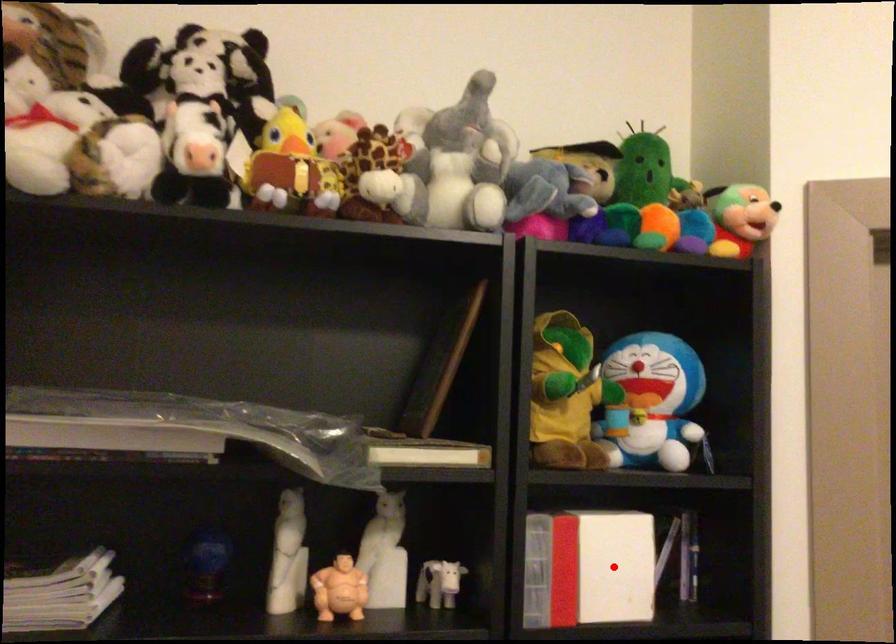
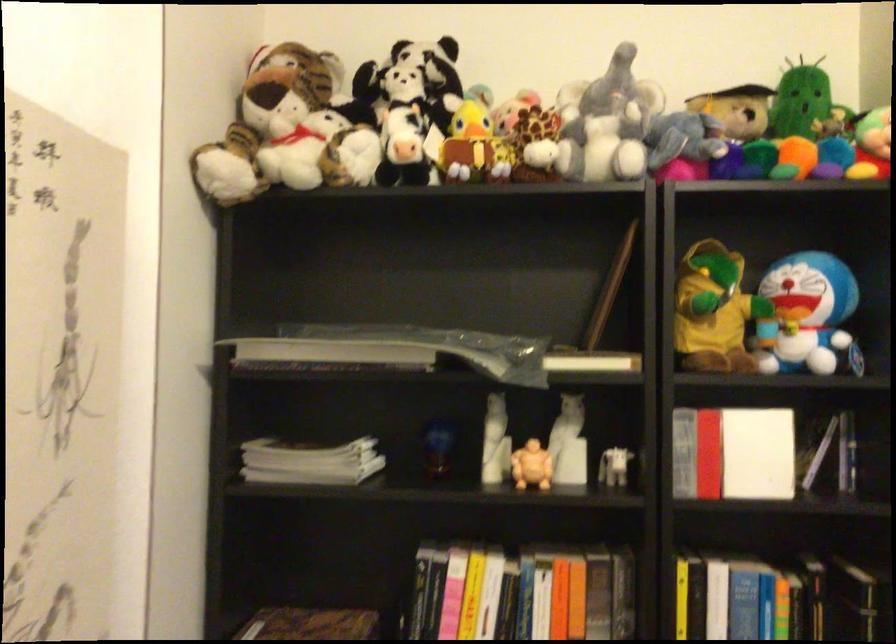
Question: A red point is marked in image1. In image2, is the corresponding 3D point closer to the camera or farther? Reply with the corresponding letter.

Choices:
 (A) The corresponding 3D point is closer.
 (B) The corresponding 3D point is farther.

Answer: (B)